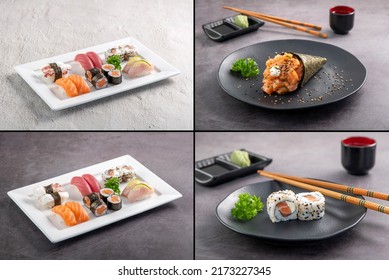
What are the coordinates of `white plate` in the screenshot? It's located at (115, 214).